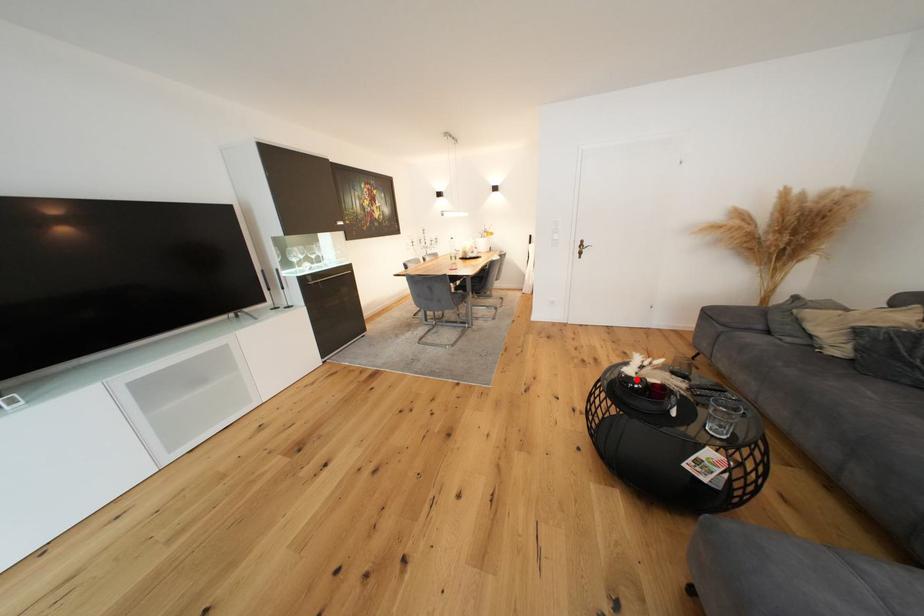
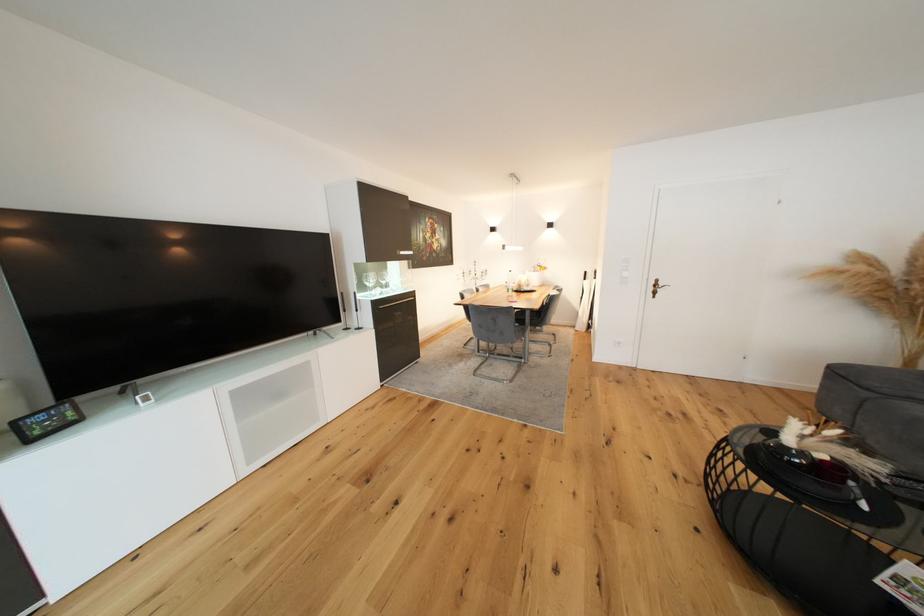
In the second image, find the point that corresponds to the highlighted location in the first image.

(792, 450)